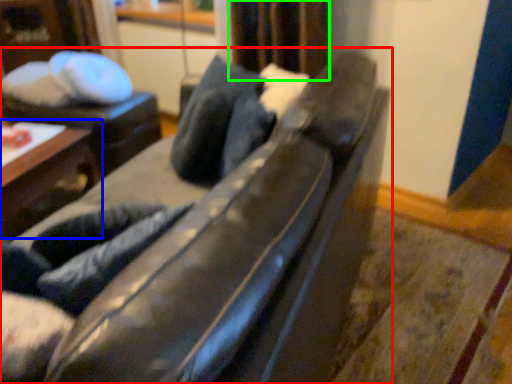
Question: Which is nearer to the studio couch (highlighted by a red box)? table (highlighted by a blue box) or curtain (highlighted by a green box).

Choices:
 (A) table
 (B) curtain

Answer: (B)